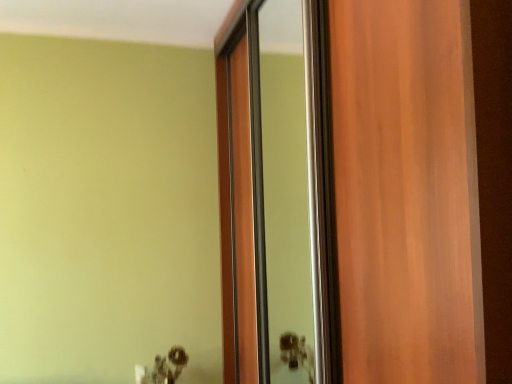
This screenshot has height=384, width=512. Describe the element at coordinates (406, 192) in the screenshot. I see `wooden door at right` at that location.

Locate an element on the screen. wooden door at right is located at coordinates (406, 192).

Where is `wooden door at right`? The height and width of the screenshot is (384, 512). wooden door at right is located at coordinates (406, 192).